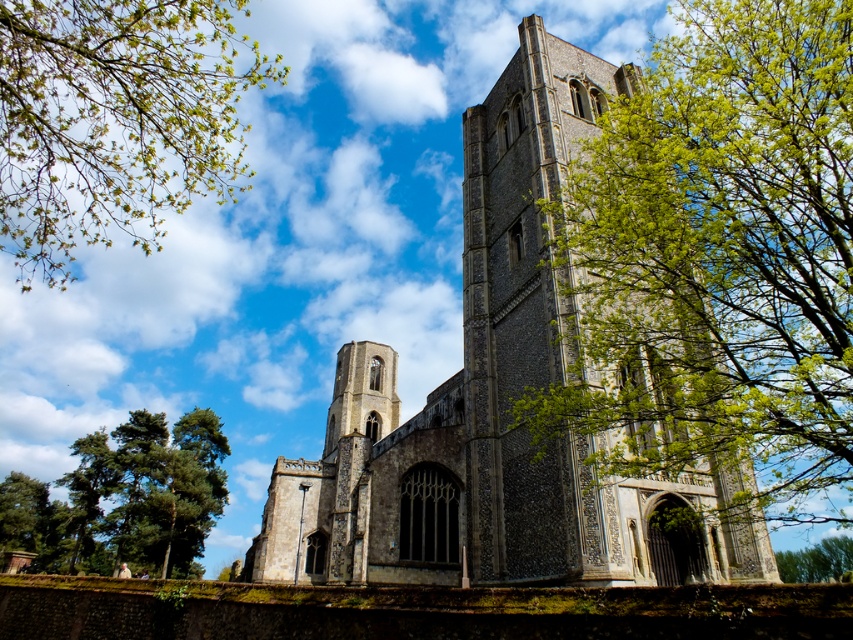
Question: Which is nearer to the green leafy tree at lower right?

Choices:
 (A) green leafy branches at upper left
 (B) green leafy tree at right
 (C) green textured tree at lower left
 (D) stone church at center

Answer: (B)

Question: Which point is closer to the camera taking this photo?

Choices:
 (A) (827, 568)
 (B) (212, 428)

Answer: (B)

Question: Can you confirm if green leafy tree at right is positioned to the right of green leafy tree at lower right?

Choices:
 (A) no
 (B) yes

Answer: (A)

Question: Which object is farther from the camera taking this photo?

Choices:
 (A) green leafy tree at right
 (B) green leafy tree at lower right
 (C) green leafy branches at upper left

Answer: (B)

Question: Does green leafy tree at right come in front of green leafy tree at lower right?

Choices:
 (A) yes
 (B) no

Answer: (A)

Question: Does green leafy tree at right appear under green leafy tree at lower right?

Choices:
 (A) no
 (B) yes

Answer: (A)